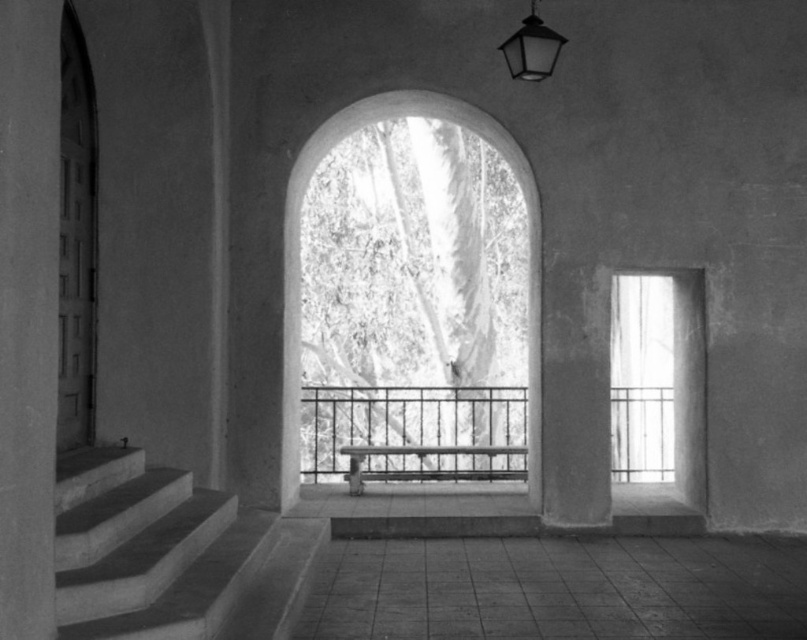
You are standing inside the building and want to look through the clear glass window at right. Is the metallic black balustrade at center blocking your view of the window?

The metallic black balustrade at center is in front of the clear glass window at right, so it would block your view of the window.